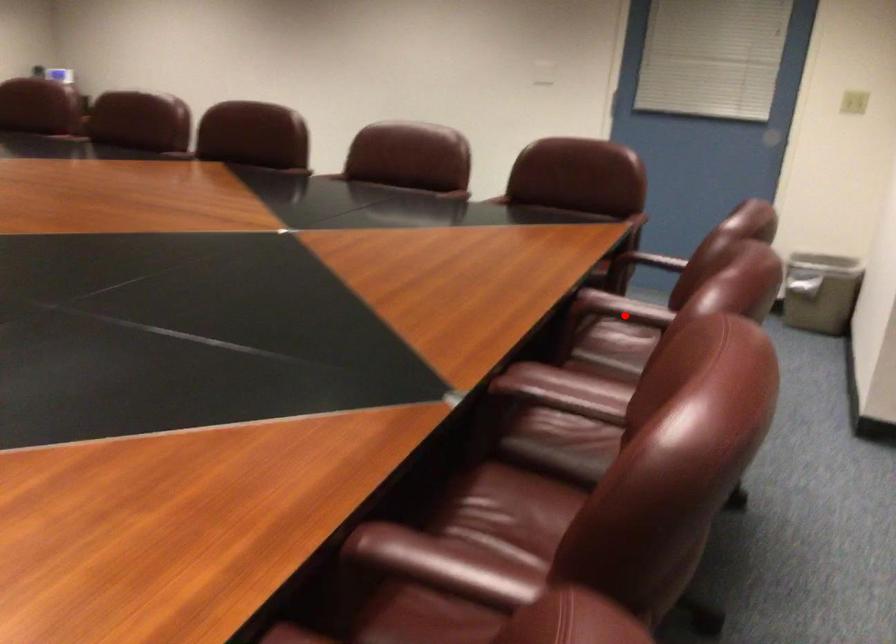
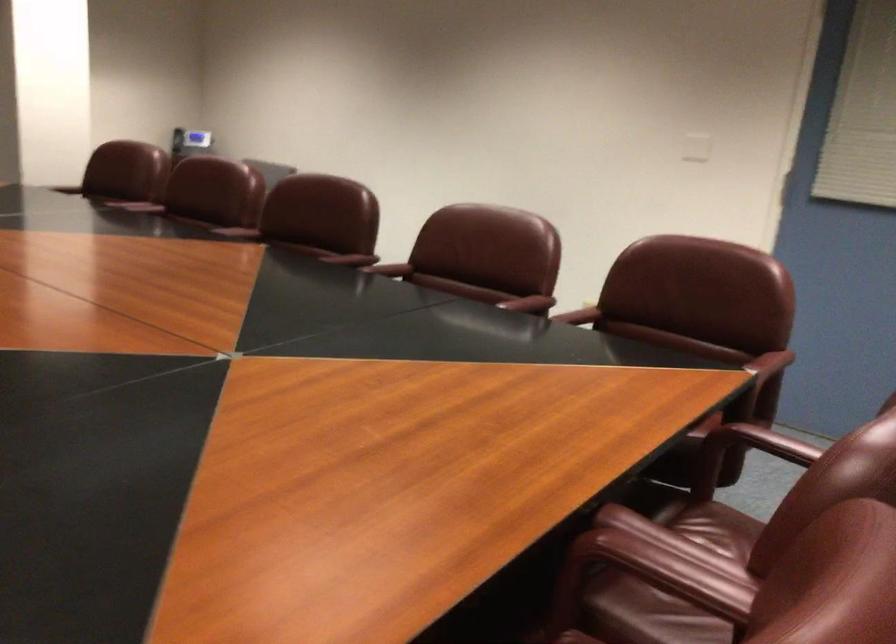
Question: I am providing you with two images of the same scene from different viewpoints. Image1 has a red point marked. In image2, the corresponding 3D location appears at what relative position? Reply with the corresponding letter.

Choices:
 (A) Closer
 (B) Farther

Answer: (A)